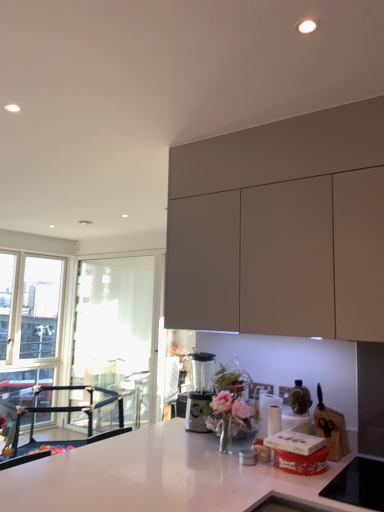
This screenshot has width=384, height=512. What do you see at coordinates (115, 330) in the screenshot?
I see `transparent glass window screen at left` at bounding box center [115, 330].

Describe the element at coordinates (281, 228) in the screenshot. The image size is (384, 512). I see `matte gray cabinet at upper right` at that location.

Locate an element on the screen. The height and width of the screenshot is (512, 384). white glossy countertop at center is located at coordinates (158, 477).

Locate an element on the screen. This screenshot has width=384, height=512. transparent glass window screen at left is located at coordinates (115, 330).

Based on the photo, is matte gray cabinet at upper right at the back of shiny metallic bottle at center?

No, matte gray cabinet at upper right is not at the back of shiny metallic bottle at center.

Considering the sizes of shiny metallic bottle at center and matte gray cabinet at upper right in the image, is shiny metallic bottle at center wider or thinner than matte gray cabinet at upper right?

Considering their sizes, shiny metallic bottle at center looks slimmer than matte gray cabinet at upper right.

Between shiny metallic bottle at center and matte gray cabinet at upper right, which one has less height?

shiny metallic bottle at center.

Are shiny metallic bottle at center and matte gray cabinet at upper right beside each other?

No, shiny metallic bottle at center is not next to matte gray cabinet at upper right.

Which of these two, shiny metallic bottle at center or sleek metallic blender at center, stands shorter?

With less height is shiny metallic bottle at center.

Considering the positions of objects shiny metallic bottle at center and sleek metallic blender at center in the image provided, who is more to the right, shiny metallic bottle at center or sleek metallic blender at center?

From the viewer's perspective, shiny metallic bottle at center appears more on the right side.

From the image's perspective, does shiny metallic bottle at center appear higher than sleek metallic blender at center?

Yes.

Is shiny metallic bottle at center next to sleek metallic blender at center?

No.

Which object is further away from the camera, transparent glass window screen at left or matte gray cabinet at upper right?

Positioned behind is transparent glass window screen at left.

From a real-world perspective, is transparent glass window screen at left positioned over matte gray cabinet at upper right based on gravity?

No, from a real-world perspective, transparent glass window screen at left is not above matte gray cabinet at upper right.

Could you tell me if transparent glass window screen at left is turned towards matte gray cabinet at upper right?

No.

Between sleek metallic blender at center and matte gray cabinet at upper right, which one appears on the right side from the viewer's perspective?

From the viewer's perspective, matte gray cabinet at upper right appears more on the right side.

Can matte gray cabinet at upper right be found inside sleek metallic blender at center?

No, matte gray cabinet at upper right is located outside of sleek metallic blender at center.

From the image's perspective, between sleek metallic blender at center and matte gray cabinet at upper right, who is located below?

sleek metallic blender at center appears lower in the image.

Considering the points (197, 375) and (193, 284), which point is in front, point (197, 375) or point (193, 284)?

The point (193, 284) is more forward.

From the image's perspective, which one is positioned higher, matte gray cabinet at upper right or transparent glass window screen at left?

matte gray cabinet at upper right.

In the scene shown: What's the angular difference between matte gray cabinet at upper right and transparent glass window screen at left's facing directions?

There is a 0.643-degree angle between the facing directions of matte gray cabinet at upper right and transparent glass window screen at left.

Considering the sizes of objects matte gray cabinet at upper right and transparent glass window screen at left in the image provided, who is wider, matte gray cabinet at upper right or transparent glass window screen at left?

matte gray cabinet at upper right.

Considering the sizes of matte gray cabinet at upper right and transparent glass window screen at left in the image, is matte gray cabinet at upper right bigger or smaller than transparent glass window screen at left?

In the image, matte gray cabinet at upper right appears to be larger than transparent glass window screen at left.

Can you confirm if transparent glass window screen at left is taller than sleek metallic blender at center?

Correct, transparent glass window screen at left is much taller as sleek metallic blender at center.

Is the depth of transparent glass window screen at left greater than that of sleek metallic blender at center?

Yes.

This screenshot has height=512, width=384. What are the coordinates of `coffee machine that appears in front of the transparent glass window screen at left` in the screenshot? It's located at (x=199, y=390).

From a real-world perspective, who is located lower, white glossy countertop at center or sleek metallic blender at center?

white glossy countertop at center, from a real-world perspective.

Can you confirm if white glossy countertop at center is taller than sleek metallic blender at center?

Correct, white glossy countertop at center is much taller as sleek metallic blender at center.

Is white glossy countertop at center located outside sleek metallic blender at center?

white glossy countertop at center lies outside sleek metallic blender at center's area.

You are a GUI agent. You are given a task and a screenshot of the screen. Output one action in this format:
    pyautogui.click(x=<x>, y=<y>)
    Task: Click on the appliance that is on the right side of matte gray cabinet at upper right
    This screenshot has height=512, width=384.
    Given the screenshot: What is the action you would take?
    pyautogui.click(x=297, y=409)

Find the location of a particular element. The height and width of the screenshot is (512, 384). appliance that appears below the sleek metallic blender at center (from a real-world perspective) is located at coordinates (297, 409).

Estimate the real-world distances between objects in this image. Which object is closer to matte gray cabinet at upper right, white glossy countertop at center or shiny metallic bottle at center?

shiny metallic bottle at center is positioned closer to the anchor matte gray cabinet at upper right.

Based on their spatial positions, is sleek metallic blender at center or shiny metallic bottle at center further from transparent glass window screen at left?

Based on the image, shiny metallic bottle at center appears to be further to transparent glass window screen at left.

Based on their spatial positions, is white glossy countertop at center or sleek metallic blender at center further from transparent glass window screen at left?

Based on the image, white glossy countertop at center appears to be further to transparent glass window screen at left.

Looking at the image, which one is located further to matte gray cabinet at upper right, sleek metallic blender at center or shiny metallic bottle at center?

sleek metallic blender at center.

When comparing their distances from transparent glass window screen at left, does sleek metallic blender at center or white glossy countertop at center seem closer?

sleek metallic blender at center is closer to transparent glass window screen at left.

Considering their positions, is sleek metallic blender at center positioned closer to white glossy countertop at center than matte gray cabinet at upper right?

sleek metallic blender at center lies closer to white glossy countertop at center than the other object.

Estimate the real-world distances between objects in this image. Which object is further from shiny metallic bottle at center, transparent glass window screen at left or sleek metallic blender at center?

The object further to shiny metallic bottle at center is transparent glass window screen at left.

Which object lies further to the anchor point sleek metallic blender at center, shiny metallic bottle at center or matte gray cabinet at upper right?

matte gray cabinet at upper right.

What are the coordinates of `appliance between matte gray cabinet at upper right and sleek metallic blender at center in the vertical direction` in the screenshot? It's located at (297, 409).

You are a GUI agent. You are given a task and a screenshot of the screen. Output one action in this format:
    pyautogui.click(x=<x>, y=<y>)
    Task: Click on the cabinetry between white glossy countertop at center and sleek metallic blender at center in the front-back direction
    The width and height of the screenshot is (384, 512).
    Given the screenshot: What is the action you would take?
    pyautogui.click(x=281, y=228)

The height and width of the screenshot is (512, 384). I want to click on coffee machine located between matte gray cabinet at upper right and transparent glass window screen at left in the depth direction, so click(199, 390).

Identify the location of appliance positioned between white glossy countertop at center and transparent glass window screen at left from near to far. (297, 409).